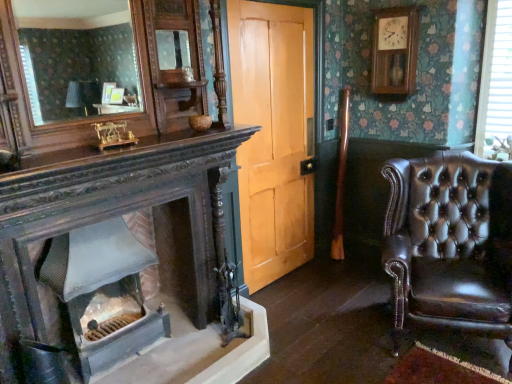
The image size is (512, 384). What do you see at coordinates (103, 293) in the screenshot? I see `smooth gray stone fireplace at lower left` at bounding box center [103, 293].

This screenshot has height=384, width=512. What do you see at coordinates (77, 57) in the screenshot?
I see `matte wooden mirror at upper left` at bounding box center [77, 57].

Image resolution: width=512 pixels, height=384 pixels. Identify the location of white plastic blinds at upper right. (496, 85).

Between shiny brown leather armchair at right and smooth gray stone fireplace at lower left, which one is positioned behind?

smooth gray stone fireplace at lower left is more distant.

Between shiny brown leather armchair at right and smooth gray stone fireplace at lower left, which one has more height?

Standing taller between the two is shiny brown leather armchair at right.

From the image's perspective, is shiny brown leather armchair at right located above or below smooth gray stone fireplace at lower left?

shiny brown leather armchair at right is above smooth gray stone fireplace at lower left.

Are shiny brown leather armchair at right and smooth gray stone fireplace at lower left located far from each other?

Indeed, shiny brown leather armchair at right is not near smooth gray stone fireplace at lower left.

Who is smaller, white plastic blinds at upper right or shiny brown leather armchair at right?

white plastic blinds at upper right is smaller.

Is white plastic blinds at upper right aimed at shiny brown leather armchair at right?

Yes, white plastic blinds at upper right is aimed at shiny brown leather armchair at right.

Which object is thinner, white plastic blinds at upper right or shiny brown leather armchair at right?

white plastic blinds at upper right is thinner.

Which of these two, white plastic blinds at upper right or shiny brown leather armchair at right, stands taller?

white plastic blinds at upper right is taller.

Is smooth gray stone fireplace at lower left positioned with its back to white plastic blinds at upper right?

No, smooth gray stone fireplace at lower left is not facing away from white plastic blinds at upper right.

Is smooth gray stone fireplace at lower left next to white plastic blinds at upper right?

No, smooth gray stone fireplace at lower left is not with white plastic blinds at upper right.

Which of these two, smooth gray stone fireplace at lower left or white plastic blinds at upper right, is wider?

Wider between the two is smooth gray stone fireplace at lower left.

Based on the photo, from the image's perspective, relative to white plastic blinds at upper right, is smooth gray stone fireplace at lower left above or below?

smooth gray stone fireplace at lower left is below white plastic blinds at upper right.

Are matte wooden mirror at upper left and shiny brown leather armchair at right far apart?

Yes, matte wooden mirror at upper left and shiny brown leather armchair at right are located far from each other.

Which is farther, (76, 86) or (410, 299)?

The point (76, 86) is farther.

From a real-world perspective, is matte wooden mirror at upper left under shiny brown leather armchair at right?

Incorrect, from a real-world perspective, matte wooden mirror at upper left is higher than shiny brown leather armchair at right.

Consider the image. Considering the relative positions of matte wooden mirror at upper left and shiny brown leather armchair at right in the image provided, is matte wooden mirror at upper left to the right of shiny brown leather armchair at right from the viewer's perspective?

Incorrect, matte wooden mirror at upper left is not on the right side of shiny brown leather armchair at right.

Is light brown wood door at center taller or shorter than matte wooden mirror at upper left?

Considering their sizes, light brown wood door at center has more height than matte wooden mirror at upper left.

Between light brown wood door at center and matte wooden mirror at upper left, which one appears on the right side from the viewer's perspective?

Positioned to the right is light brown wood door at center.

Are light brown wood door at center and matte wooden mirror at upper left making contact?

No, light brown wood door at center is not making contact with matte wooden mirror at upper left.

How many degrees apart are the facing directions of light brown wood door at center and matte wooden mirror at upper left?

The angular difference between light brown wood door at center and matte wooden mirror at upper left is 2.7 degrees.

Considering the relative positions of shiny brown leather armchair at right and light brown wood door at center in the image provided, is shiny brown leather armchair at right to the right of light brown wood door at center from the viewer's perspective?

Indeed, shiny brown leather armchair at right is positioned on the right side of light brown wood door at center.

Between shiny brown leather armchair at right and light brown wood door at center, which one is positioned in front?

shiny brown leather armchair at right is in front.

This screenshot has width=512, height=384. What are the coordinates of `door above the shiny brown leather armchair at right (from a real-world perspective)` in the screenshot? It's located at (273, 135).

Does point (387, 216) appear closer or farther from the camera than point (296, 91)?

Point (387, 216) is positioned closer to the camera compared to point (296, 91).

Does white plastic blinds at upper right have a larger size compared to matte wooden mirror at upper left?

No, white plastic blinds at upper right is not bigger than matte wooden mirror at upper left.

Do you think white plastic blinds at upper right is within matte wooden mirror at upper left, or outside of it?

white plastic blinds at upper right is located beyond the bounds of matte wooden mirror at upper left.

From a real-world perspective, does white plastic blinds at upper right stand above matte wooden mirror at upper left?

No, from a real-world perspective, white plastic blinds at upper right is not over matte wooden mirror at upper left

Locate an element on the screen. mirror below the white plastic blinds at upper right (from the image's perspective) is located at coordinates (77, 57).

Locate an element on the screen. fireplace below the shiny brown leather armchair at right (from a real-world perspective) is located at coordinates (103, 293).

Image resolution: width=512 pixels, height=384 pixels. Find the location of `chair that appears in front of the white plastic blinds at upper right`. chair that appears in front of the white plastic blinds at upper right is located at coordinates (450, 243).

Looking at this image, when comparing their distances from shiny brown leather armchair at right, does smooth gray stone fireplace at lower left or matte wooden mirror at upper left seem further?

Among the two, matte wooden mirror at upper left is located further to shiny brown leather armchair at right.

Looking at this image, considering their positions, is light brown wood door at center positioned closer to white plastic blinds at upper right than shiny brown leather armchair at right?

The object closer to white plastic blinds at upper right is shiny brown leather armchair at right.

When comparing their distances from white plastic blinds at upper right, does shiny brown leather armchair at right or light brown wood door at center seem further?

The object further to white plastic blinds at upper right is light brown wood door at center.

Estimate the real-world distances between objects in this image. Which object is further from shiny brown leather armchair at right, white plastic blinds at upper right or matte wooden mirror at upper left?

matte wooden mirror at upper left lies further to shiny brown leather armchair at right than the other object.

When comparing their distances from smooth gray stone fireplace at lower left, does shiny brown leather armchair at right or light brown wood door at center seem further?

shiny brown leather armchair at right lies further to smooth gray stone fireplace at lower left than the other object.

Considering their positions, is matte wooden mirror at upper left positioned closer to white plastic blinds at upper right than shiny brown leather armchair at right?

shiny brown leather armchair at right is positioned closer to the anchor white plastic blinds at upper right.

Which object lies nearer to the anchor point matte wooden mirror at upper left, shiny brown leather armchair at right or white plastic blinds at upper right?

Based on the image, shiny brown leather armchair at right appears to be nearer to matte wooden mirror at upper left.

Which object lies further to the anchor point light brown wood door at center, white plastic blinds at upper right or smooth gray stone fireplace at lower left?

Among the two, white plastic blinds at upper right is located further to light brown wood door at center.

I want to click on mirror situated between smooth gray stone fireplace at lower left and white plastic blinds at upper right from left to right, so click(x=77, y=57).

Locate an element on the screen. The height and width of the screenshot is (384, 512). chair between smooth gray stone fireplace at lower left and white plastic blinds at upper right in the horizontal direction is located at coordinates (450, 243).

The width and height of the screenshot is (512, 384). I want to click on door between smooth gray stone fireplace at lower left and white plastic blinds at upper right, so [x=273, y=135].

The image size is (512, 384). Identify the location of chair between light brown wood door at center and white plastic blinds at upper right from left to right. (450, 243).